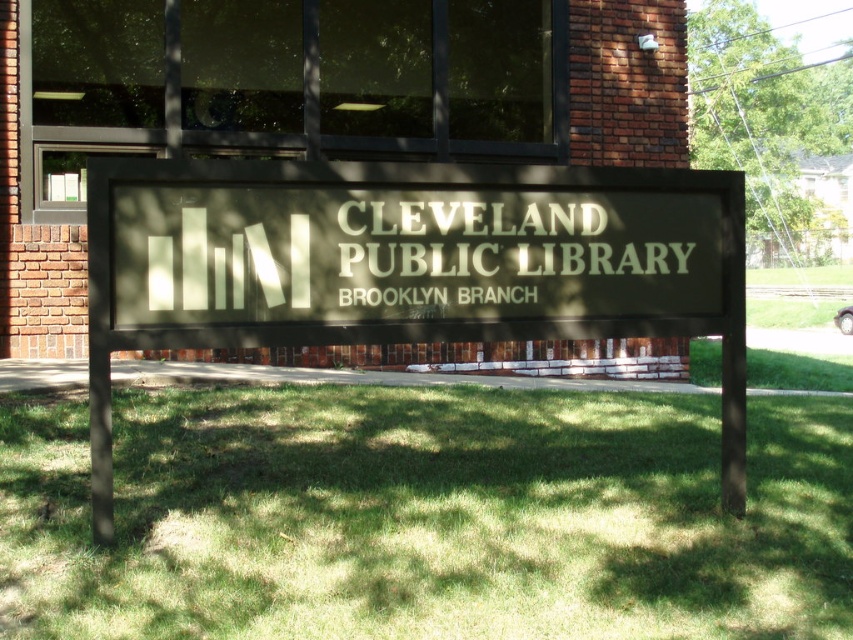
You are standing in front of the Cleveland Public Library Brooklyn Branch and want to take a photo of the matte black sign at center. To ensure the green grass at center is visible in the background, should you position yourself closer to or farther from the sign?

The green grass at center is in front of matte black sign at center, so to have the grass visible in the background behind the sign, you should position yourself farther from the sign. This way, both the sign and the grass behind it will be in the frame.